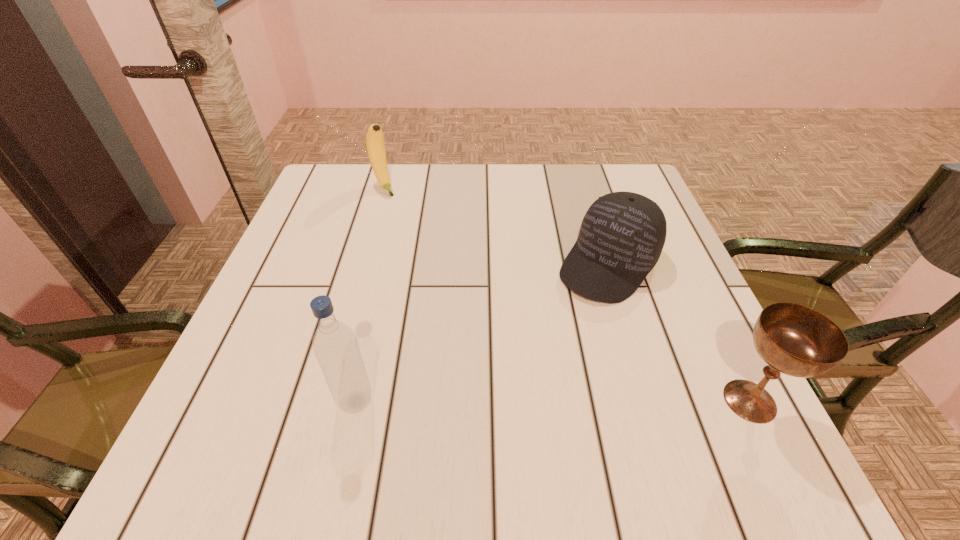
The height and width of the screenshot is (540, 960). I want to click on object at the near right corner, so (793, 339).

You are a GUI agent. You are given a task and a screenshot of the screen. Output one action in this format:
    pyautogui.click(x=<x>, y=<y>)
    Task: Click on the free space at the far edge of the desktop
    This screenshot has width=960, height=540.
    Given the screenshot: What is the action you would take?
    pyautogui.click(x=449, y=175)

You are a GUI agent. You are given a task and a screenshot of the screen. Output one action in this format:
    pyautogui.click(x=<x>, y=<y>)
    Task: Click on the free space at the near edge of the desktop
    
    Given the screenshot: What is the action you would take?
    pyautogui.click(x=396, y=414)

In the image, there is a desktop. Where is `vacant space at the left edge`? vacant space at the left edge is located at coordinates (321, 239).

This screenshot has height=540, width=960. I want to click on free location at the right edge of the desktop, so [x=690, y=373].

Identify the location of vacant space at the far left corner. The image size is (960, 540). (345, 170).

The width and height of the screenshot is (960, 540). Find the location of `free space at the near left corner`. free space at the near left corner is located at coordinates (244, 396).

The image size is (960, 540). What are the coordinates of `vacant space at the far right corner of the desktop` in the screenshot? It's located at (585, 171).

Where is `free spot between the tallest object and the baseball cap`? The height and width of the screenshot is (540, 960). free spot between the tallest object and the baseball cap is located at coordinates (482, 333).

Where is `free point between the tallest object and the chalice`? free point between the tallest object and the chalice is located at coordinates (553, 401).